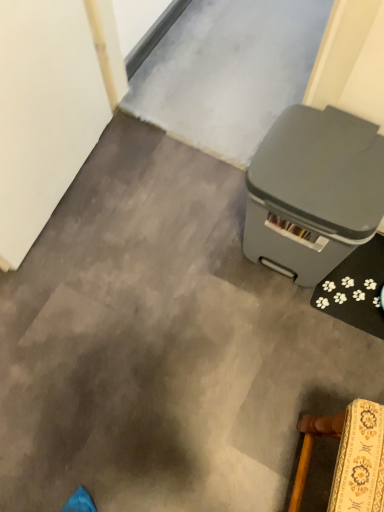
Where is `vacant space to the left of wooden upholstered chair at lower right`? The height and width of the screenshot is (512, 384). vacant space to the left of wooden upholstered chair at lower right is located at coordinates (236, 448).